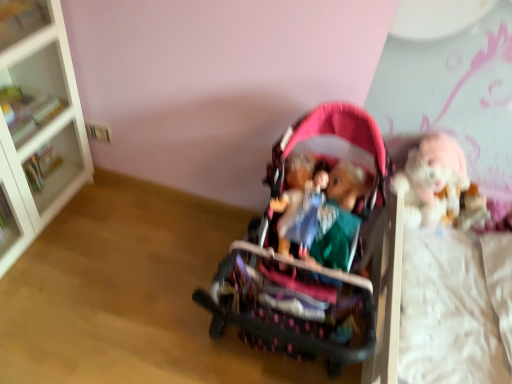
Question: From a real-world perspective, is matte plastic doll at center located higher than pink fabric stroller at center?

Choices:
 (A) yes
 (B) no

Answer: (A)

Question: Is matte plastic doll at center bigger than pink fabric stroller at center?

Choices:
 (A) no
 (B) yes

Answer: (A)

Question: From the image's perspective, is matte plastic doll at center located above pink fabric stroller at center?

Choices:
 (A) yes
 (B) no

Answer: (A)

Question: Considering the relative sizes of matte plastic doll at center and pink fabric stroller at center in the image provided, is matte plastic doll at center thinner than pink fabric stroller at center?

Choices:
 (A) yes
 (B) no

Answer: (A)

Question: Is matte plastic doll at center next to pink fabric stroller at center and touching it?

Choices:
 (A) yes
 (B) no

Answer: (A)

Question: Is matte plastic doll at center in front of or behind fluffy white doll at right in the image?

Choices:
 (A) behind
 (B) front

Answer: (B)

Question: From the image's perspective, is matte plastic doll at center positioned above or below fluffy white doll at right?

Choices:
 (A) above
 (B) below

Answer: (B)

Question: In the image, is matte plastic doll at center on the left side or the right side of fluffy white doll at right?

Choices:
 (A) left
 (B) right

Answer: (A)

Question: From a real-world perspective, is matte plastic doll at center above or below fluffy white doll at right?

Choices:
 (A) above
 (B) below

Answer: (B)

Question: Based on their sizes in the image, would you say pink fabric stroller at center is bigger or smaller than white glossy cabinet at upper left?

Choices:
 (A) small
 (B) big

Answer: (B)

Question: From a real-world perspective, is pink fabric stroller at center physically located above or below white glossy cabinet at upper left?

Choices:
 (A) below
 (B) above

Answer: (A)

Question: Is pink fabric stroller at center situated inside white glossy cabinet at upper left or outside?

Choices:
 (A) inside
 (B) outside

Answer: (B)

Question: Is point (311, 269) closer or farther from the camera than point (34, 91)?

Choices:
 (A) closer
 (B) farther

Answer: (A)

Question: Considering the positions of point (11, 74) and point (411, 208), is point (11, 74) closer or farther from the camera than point (411, 208)?

Choices:
 (A) farther
 (B) closer

Answer: (A)

Question: Considering the positions of white glossy cabinet at upper left and fluffy white doll at right in the image, is white glossy cabinet at upper left taller or shorter than fluffy white doll at right?

Choices:
 (A) tall
 (B) short

Answer: (B)